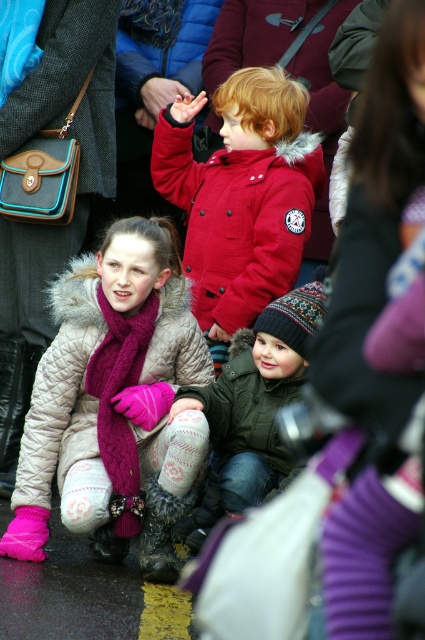
You are a photographer trying to capture a group photo of the red matte jacket at center and the green fuzzy jacket at center. Which child should you position closer to the camera to ensure both are in focus?

You should position the red matte jacket at center closer to the camera since it is already further to the viewer than the green fuzzy jacket at center, ensuring both are in focus.

You are a photographer trying to capture a group photo of the children. You want to ensure that both the red matte jacket at center and the quilted beige jacket at lower left are clearly visible in the frame. Based on their positions and sizes, which jacket might require you to adjust your camera angle to avoid being cut off?

The red matte jacket at center might require adjusting the camera angle since it is wider than the quilted beige jacket at lower left, increasing the risk of being cut off if not framed properly.

You are a photographer wanting to capture both the red matte jacket at center and the green fuzzy jacket at center in a single frame. Given their sizes, which jacket should you position closer to the camera to ensure both are fully visible without cropping?

The red matte jacket at center is wider than the green fuzzy jacket at center. To ensure both are fully visible, position the wider red matte jacket at center closer to the camera. This way, the narrower green fuzzy jacket at center can be placed further back without being cropped out.